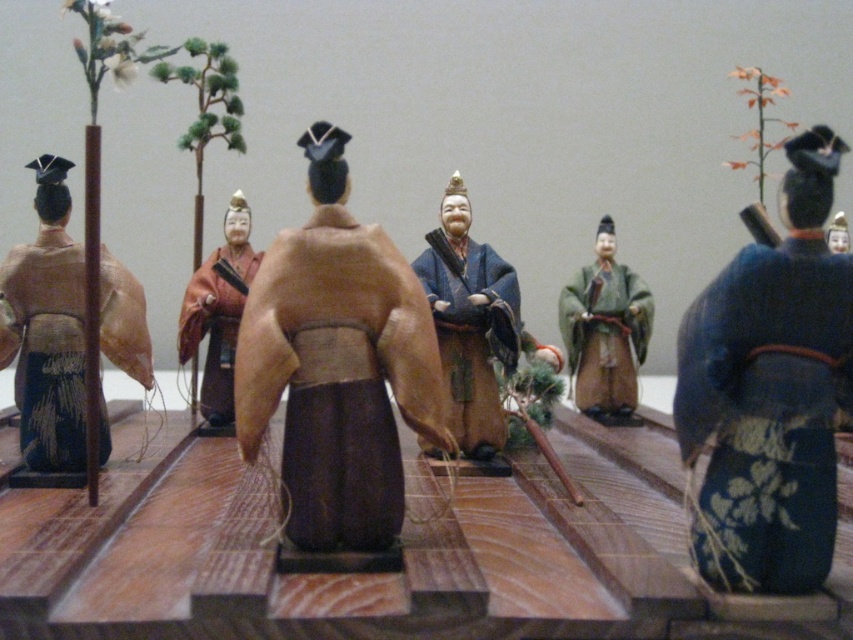
You are standing in front of the miniature scene and want to place a small decoration at the point marked as point (337,364). According to the scene description, where will this decoration be placed relative to the brown matte kimono at center?

The point (337,364) is on the brown matte kimono at center, so the decoration will be placed directly on the brown matte kimono at center.